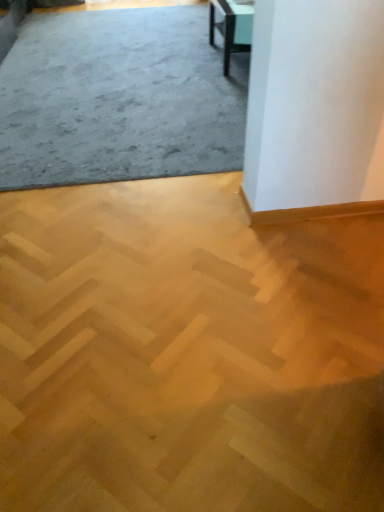
Question: Considering the relative positions of matte black table at upper right and light brown wood parquet at center, which is the 2th concrete from top to bottom, in the image provided, is matte black table at upper right to the right of light brown wood parquet at center, which is the 2th concrete from top to bottom, from the viewer's perspective?

Choices:
 (A) no
 (B) yes

Answer: (B)

Question: Is matte black table at upper right bigger than light brown wood parquet at center, the 1th concrete positioned from the bottom?

Choices:
 (A) yes
 (B) no

Answer: (A)

Question: Is matte black table at upper right taller than light brown wood parquet at center, which is the 2th concrete from top to bottom?

Choices:
 (A) yes
 (B) no

Answer: (A)

Question: Is matte black table at upper right further to camera compared to light brown wood parquet at center, which is counted as the first concrete, starting from the front?

Choices:
 (A) no
 (B) yes

Answer: (B)

Question: Could you tell me if matte black table at upper right is turned towards light brown wood parquet at center, which is the 2th concrete from top to bottom?

Choices:
 (A) no
 (B) yes

Answer: (A)

Question: Considering the relative positions of gray carpet at upper left, placed as the first concrete when sorted from top to bottom, and light brown wood parquet at center, the 2th concrete from the back, in the image provided, is gray carpet at upper left, placed as the first concrete when sorted from top to bottom, to the left or to the right of light brown wood parquet at center, the 2th concrete from the back,?

Choices:
 (A) left
 (B) right

Answer: (A)

Question: Considering the positions of point (206, 54) and point (226, 397), is point (206, 54) closer or farther from the camera than point (226, 397)?

Choices:
 (A) closer
 (B) farther

Answer: (B)

Question: In terms of width, does gray carpet at upper left, which appears as the 2th concrete when ordered from the bottom, look wider or thinner when compared to light brown wood parquet at center, the 2th concrete from the back?

Choices:
 (A) wide
 (B) thin

Answer: (A)

Question: From the image's perspective, relative to light brown wood parquet at center, which is the 2th concrete from top to bottom, is gray carpet at upper left, acting as the 1th concrete starting from the back, above or below?

Choices:
 (A) below
 (B) above

Answer: (B)

Question: Considering the positions of light brown wood parquet at center, the 1th concrete positioned from the bottom, and gray carpet at upper left, the second concrete when ordered from front to back, in the image, is light brown wood parquet at center, the 1th concrete positioned from the bottom, bigger or smaller than gray carpet at upper left, the second concrete when ordered from front to back,?

Choices:
 (A) big
 (B) small

Answer: (B)

Question: Is point (157, 454) closer or farther from the camera than point (64, 163)?

Choices:
 (A) farther
 (B) closer

Answer: (B)

Question: Is light brown wood parquet at center, which is the 2th concrete from top to bottom, in front of or behind gray carpet at upper left, placed as the first concrete when sorted from top to bottom, in the image?

Choices:
 (A) front
 (B) behind

Answer: (A)

Question: From a real-world perspective, is light brown wood parquet at center, the 1th concrete positioned from the bottom, physically located above or below gray carpet at upper left, placed as the first concrete when sorted from top to bottom?

Choices:
 (A) below
 (B) above

Answer: (A)

Question: Based on their sizes in the image, would you say matte black table at upper right is bigger or smaller than gray carpet at upper left, which appears as the 2th concrete when ordered from the bottom?

Choices:
 (A) big
 (B) small

Answer: (B)

Question: In the image, is matte black table at upper right on the left side or the right side of gray carpet at upper left, placed as the first concrete when sorted from top to bottom?

Choices:
 (A) right
 (B) left

Answer: (A)